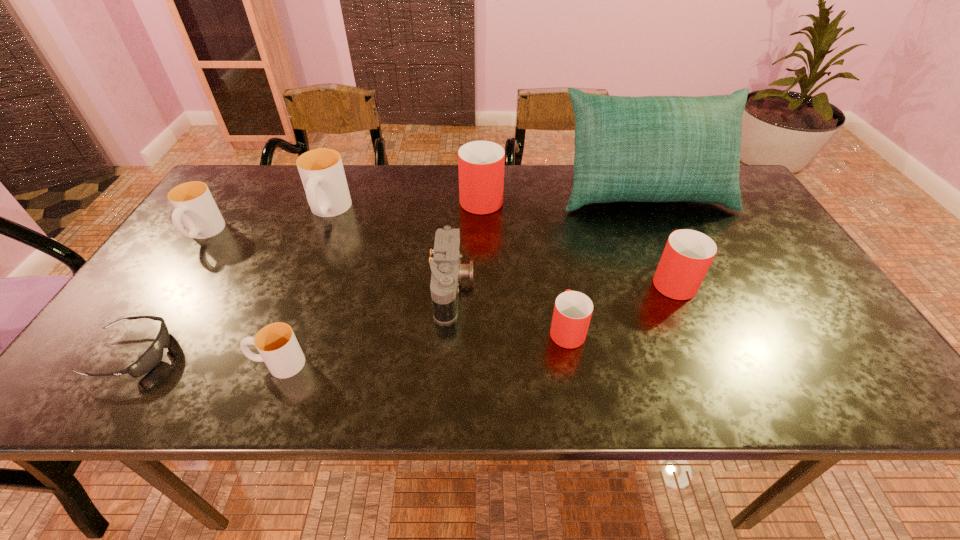
Find the location of a particular element. vacant area located 0.250m with the handle on the side of the second biggest yellow cup is located at coordinates (138, 327).

Identify the location of vacant region located 0.070m on the lens of the camera. The width and height of the screenshot is (960, 540). (502, 288).

Image resolution: width=960 pixels, height=540 pixels. I want to click on vacant space located 0.270m on the side of the fifth cup from left to right with the handle, so click(550, 234).

The image size is (960, 540). Identify the location of vacant area located on the side of the fifth cup from left to right with the handle. (x=556, y=265).

The width and height of the screenshot is (960, 540). Identify the location of vacant area located 0.310m on the side of the fifth cup from left to right with the handle. (548, 225).

Find the location of a particular element. This screenshot has width=960, height=540. vacant space located 0.260m with the handle on the side of the nearest cup is located at coordinates (125, 364).

I want to click on blank space located with the handle on the side of the nearest cup, so click(106, 364).

Find the location of `vacant space located 0.170m with the handle on the side of the nearest cup`. vacant space located 0.170m with the handle on the side of the nearest cup is located at coordinates (169, 364).

Image resolution: width=960 pixels, height=540 pixels. Identify the location of vacant space situated 0.190m on the lenses of the black goggles. (261, 354).

The width and height of the screenshot is (960, 540). Identify the location of cushion located in the far edge section of the desktop. (651, 148).